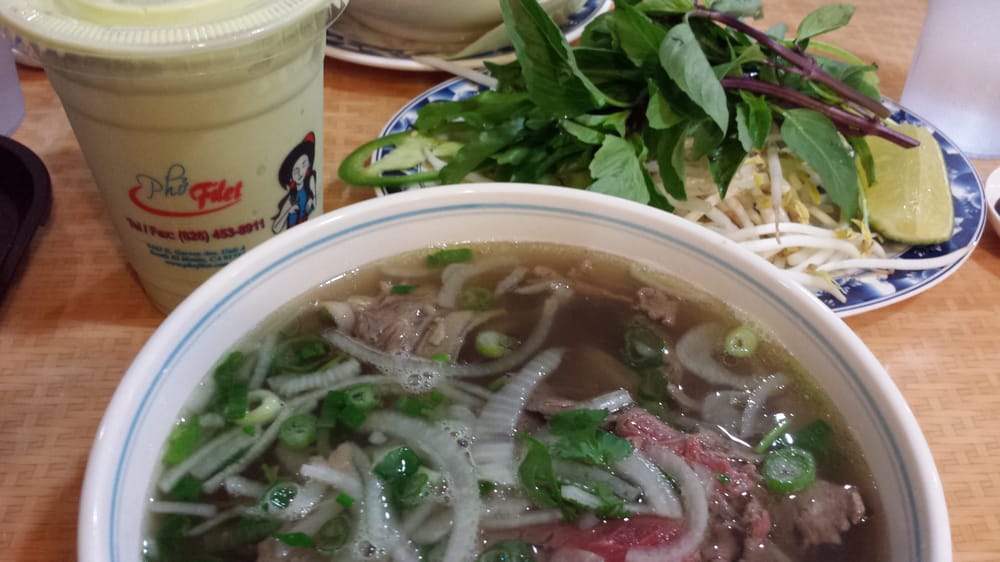
In order to click on lid of cup in this screenshot , I will do `click(198, 49)`.